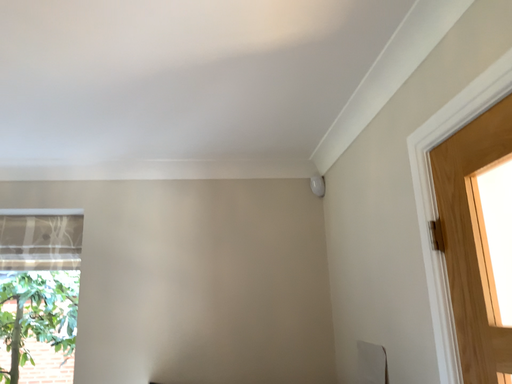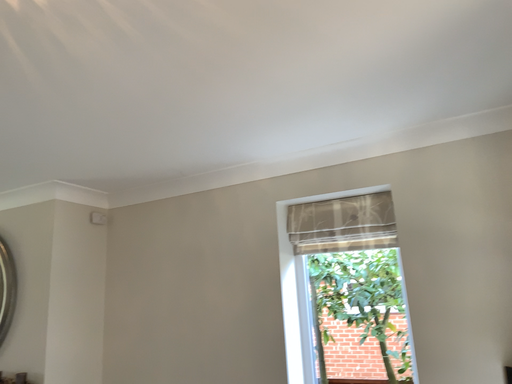
Question: How did the camera likely rotate when shooting the video?

Choices:
 (A) rotated left
 (B) rotated right

Answer: (A)